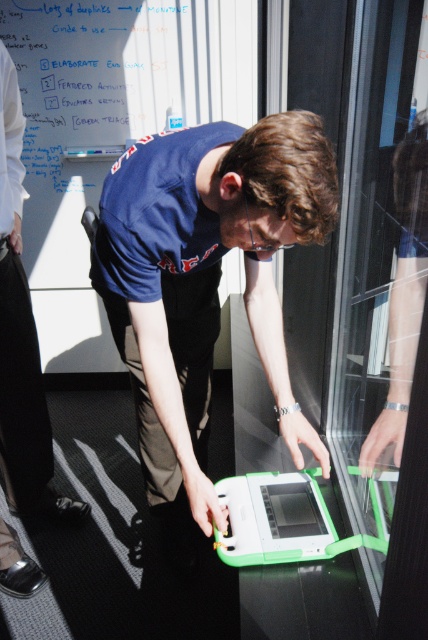
Is whiteboard at upper left smaller than white cotton shirt at upper left?

Incorrect, whiteboard at upper left is not smaller in size than white cotton shirt at upper left.

Is whiteboard at upper left taller than white cotton shirt at upper left?

Correct, whiteboard at upper left is much taller as white cotton shirt at upper left.

The image size is (428, 640). Describe the element at coordinates (109, 128) in the screenshot. I see `whiteboard at upper left` at that location.

The image size is (428, 640). Identify the location of whiteboard at upper left. (109, 128).

Who is higher up, green matte laptop at center or white cotton shirt at upper left?

Positioned higher is white cotton shirt at upper left.

Does green matte laptop at center appear on the right side of white cotton shirt at upper left?

Indeed, green matte laptop at center is positioned on the right side of white cotton shirt at upper left.

Is point (174, 336) more distant than point (12, 154)?

No.

Image resolution: width=428 pixels, height=640 pixels. I want to click on green matte laptop at center, so click(205, 276).

Who is positioned more to the left, green matte laptop at center or whiteboard at upper left?

whiteboard at upper left

Between green matte laptop at center and whiteboard at upper left, which one has more height?

whiteboard at upper left

Does point (315, 204) come behind point (154, 109)?

That is False.

Locate an element on the screen. green matte laptop at center is located at coordinates (205, 276).